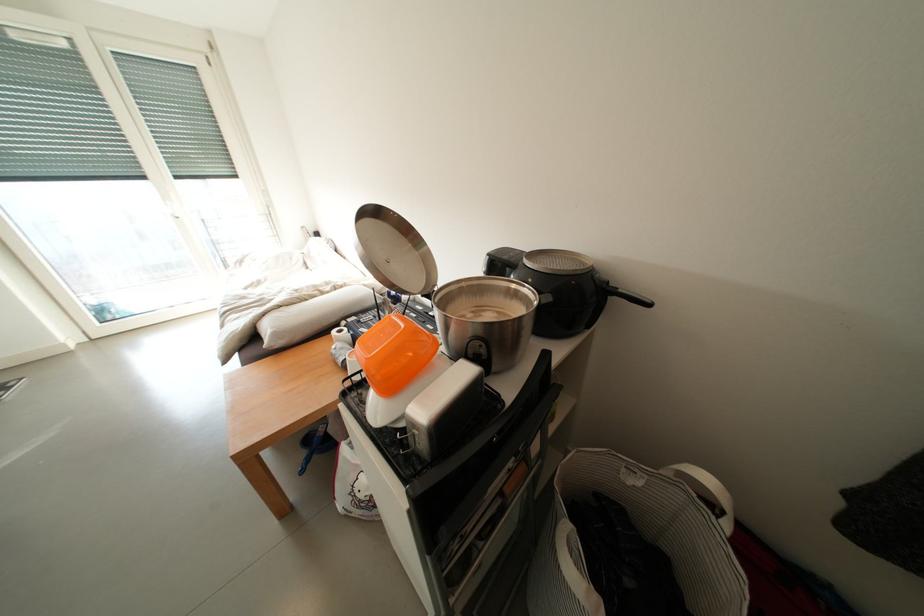
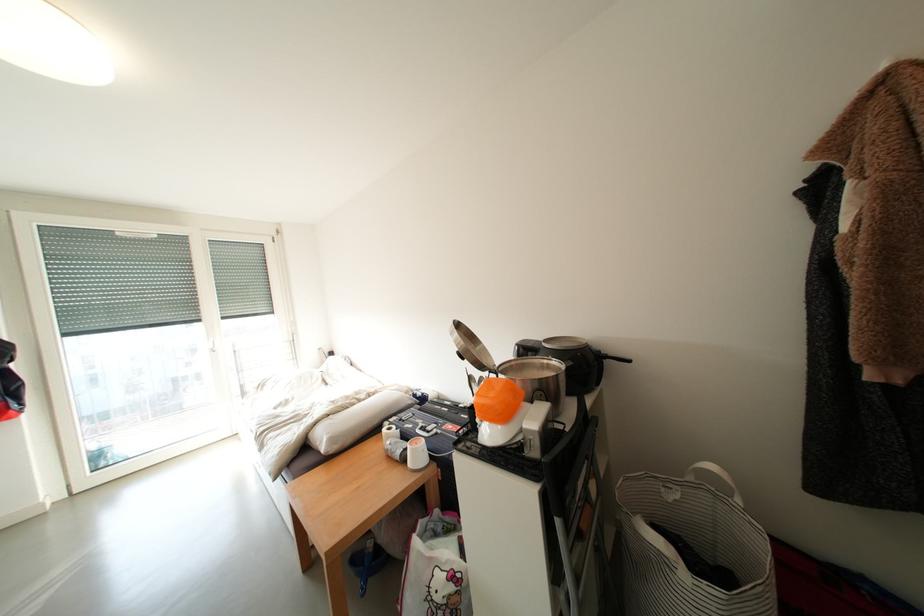
Where in the second image is the point corresponding to the point at 532,461 from the first image?

(594, 503)